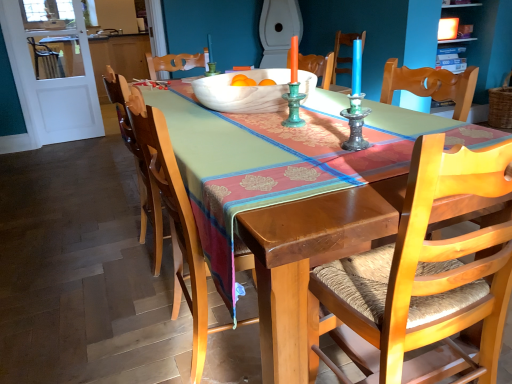
Question: Do you think wooden chair with woven seat at center, which is the second chair from left to right, is within wooden chair with woven seat at center, which ranks as the first chair in left-to-right order, or outside of it?

Choices:
 (A) inside
 (B) outside

Answer: (B)

Question: In terms of size, does wooden chair with woven seat at center, which is the second chair from left to right, appear bigger or smaller than wooden chair with woven seat at center, the second chair from the right?

Choices:
 (A) big
 (B) small

Answer: (B)

Question: Which object is the farthest from the white marble bowl at center?

Choices:
 (A) wooden chair with woven seat at center, which is the 1th chair in right-to-left order
 (B) white glossy toilet at upper center
 (C) wooden chair with woven seat at center, which ranks as the first chair in left-to-right order

Answer: (B)

Question: Which of these objects is positioned farthest from the wooden chair with woven seat at center, which is the second chair from left to right?

Choices:
 (A) wooden chair with woven seat at center, which ranks as the first chair in left-to-right order
 (B) white glossy toilet at upper center
 (C) white marble bowl at center

Answer: (B)